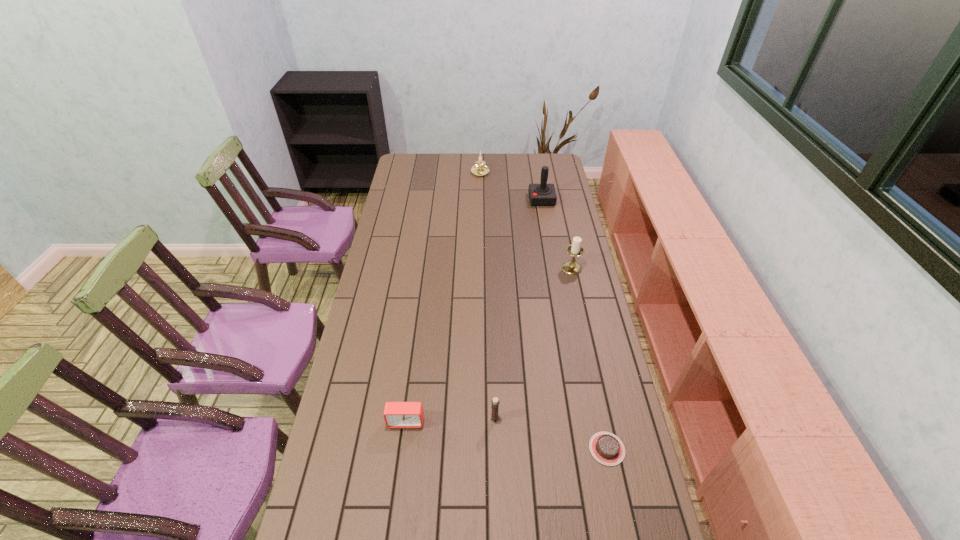
Locate an element on the screen. The image size is (960, 540). the second farthest object is located at coordinates (543, 194).

This screenshot has height=540, width=960. In order to click on the tallest candle holder in this screenshot , I will do `click(575, 249)`.

Find the location of a particular element. Image resolution: width=960 pixels, height=540 pixels. the second nearest candle holder is located at coordinates (575, 249).

This screenshot has height=540, width=960. Identify the location of the farthest candle holder. (480, 169).

Find the location of a particular element. The width and height of the screenshot is (960, 540). the nearest candle holder is located at coordinates (495, 402).

The image size is (960, 540). What are the coordinates of `alarm clock` in the screenshot? It's located at (396, 414).

The image size is (960, 540). I want to click on the second shortest object, so click(x=396, y=414).

I want to click on the shortest object, so click(606, 448).

Find the location of a particular element. the nearest object is located at coordinates (606, 448).

Locate an element on the screen. The width and height of the screenshot is (960, 540). vacant point located 0.300m on the base of the second farthest object is located at coordinates (470, 200).